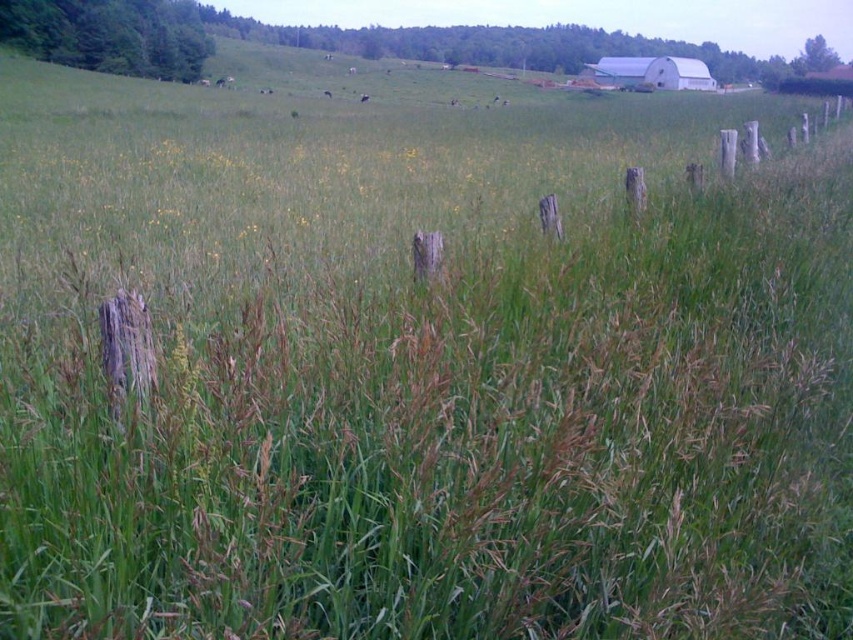
You are standing at the center of the grassy field. You need to locate the weathered wood fence posts at center. According to the coordinates provided, where exactly should you look?

You should look at point (x=622, y=195) to locate the weathered wood fence posts at center.

You are a farmer checking the condition of your property. You notice the weathered wood fence posts at center and the white matte barn at upper right. Which object is bigger in size?

The weathered wood fence posts at center are larger in size compared to the white matte barn at upper right according to the description.

You are a painter standing at the edge of the grassy field. You want to paint the scene so that the weathered wood fence posts at center and the white matte barn at upper right are both visible in your painting. However, you are concerned that one might block the view of the other. Based on their heights, which object will be more likely to be visible behind the other?

The weathered wood fence posts at center are taller than the white matte barn at upper right, so the barn might be partially hidden behind the fence posts if they are positioned between the painter and the barn.